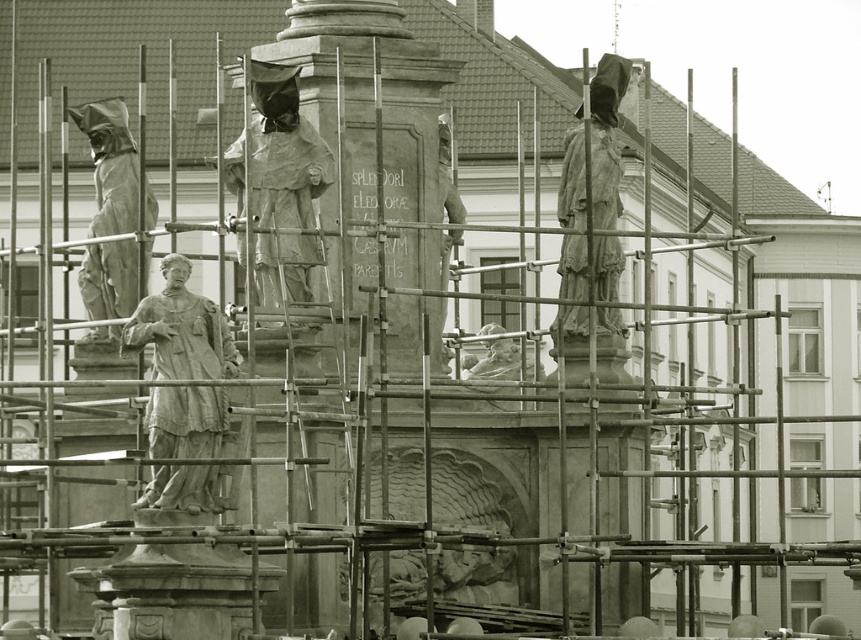
Question: Where is stone statue at center located in relation to matte stone statue at left in the image?

Choices:
 (A) below
 (B) above

Answer: (A)

Question: In this image, where is smooth stone statue at center located relative to matte stone statue at upper right?

Choices:
 (A) below
 (B) above

Answer: (A)

Question: Which object appears closest to the camera in this image?

Choices:
 (A) stone statue at center
 (B) matte stone statue at left
 (C) matte stone statue at upper right
 (D) smooth stone statue at center

Answer: (A)

Question: Which of these objects is positioned closest to the smooth stone statue at center?

Choices:
 (A) stone statue at center
 (B) matte stone statue at left
 (C) matte stone statue at upper right

Answer: (B)

Question: Among these points, which one is farthest from the camera?

Choices:
 (A) (160, 468)
 (B) (561, 180)
 (C) (279, 67)

Answer: (B)

Question: Does stone statue at center have a greater width compared to matte stone statue at left?

Choices:
 (A) no
 (B) yes

Answer: (A)